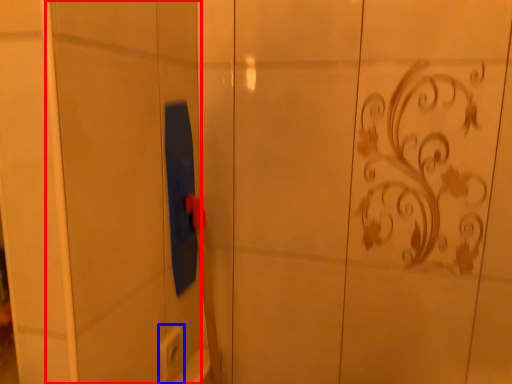
Question: Which point is closer to the camera, screen door (highlighted by a red box) or electric outlet (highlighted by a blue box)?

Choices:
 (A) screen door
 (B) electric outlet

Answer: (A)